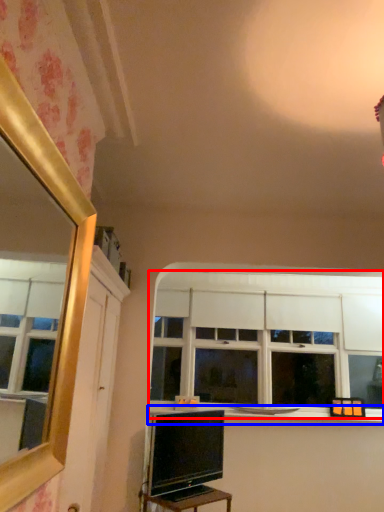
Question: Which of the following is the farthest to the observer, window (highlighted by a red box) or window sill (highlighted by a blue box)?

Choices:
 (A) window
 (B) window sill

Answer: (A)